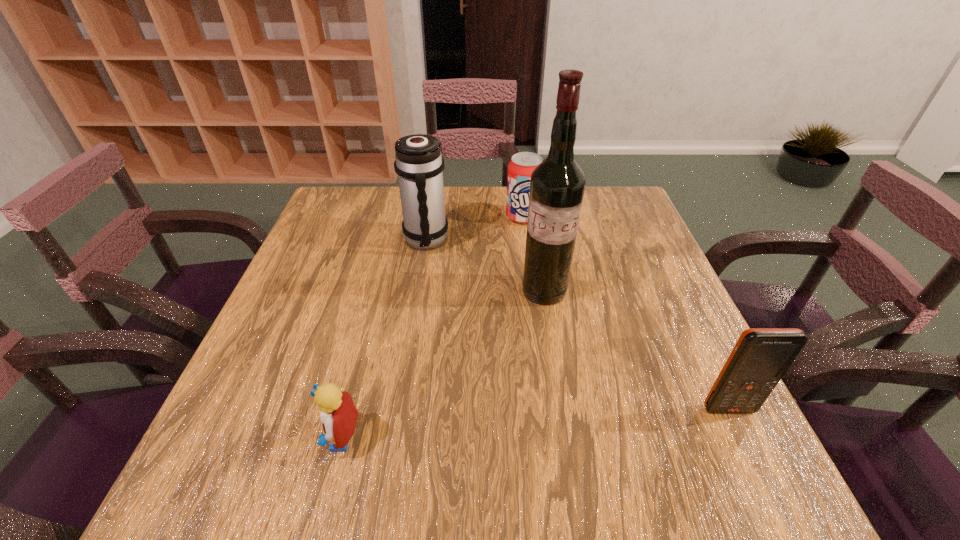
You are a GUI agent. You are given a task and a screenshot of the screen. Output one action in this format:
    pyautogui.click(x=<x>, y=<y>)
    Task: Click on the vacant region located on the front-facing side of the Lego
    This screenshot has height=540, width=960.
    Given the screenshot: What is the action you would take?
    pyautogui.click(x=223, y=437)

This screenshot has height=540, width=960. I want to click on free region located on the surface of the soda can, so click(x=525, y=253).

The width and height of the screenshot is (960, 540). I want to click on free space located on the surface of the soda can, so click(x=528, y=305).

Where is `free region located 0.290m on the surface of the soda can`? free region located 0.290m on the surface of the soda can is located at coordinates (527, 299).

You are a GUI agent. You are given a task and a screenshot of the screen. Output one action in this format:
    pyautogui.click(x=<x>, y=<y>)
    Task: Click on the free space located 0.100m on the side with the handle of the second tallest object
    
    Given the screenshot: What is the action you would take?
    tap(442, 281)

At what (x,y) coordinates should I click in order to perform the action: click on vacant area situated 0.260m on the side with the handle of the second tallest object. Please return your answer as a coordinate pair (x, y). Looking at the image, I should click on (462, 329).

Find the location of a particular element. This screenshot has height=540, width=960. vacant space located on the side with the handle of the second tallest object is located at coordinates (448, 298).

In order to click on free location located 0.130m on the front and back of the third farthest object in this screenshot , I will do `click(529, 350)`.

You are a GUI agent. You are given a task and a screenshot of the screen. Output one action in this format:
    pyautogui.click(x=<x>, y=<y>)
    Task: Click on the vacant space located on the front and back of the third farthest object
    
    Given the screenshot: What is the action you would take?
    pyautogui.click(x=533, y=335)

The image size is (960, 540). I want to click on blank space located on the front and back of the third farthest object, so click(x=523, y=374).